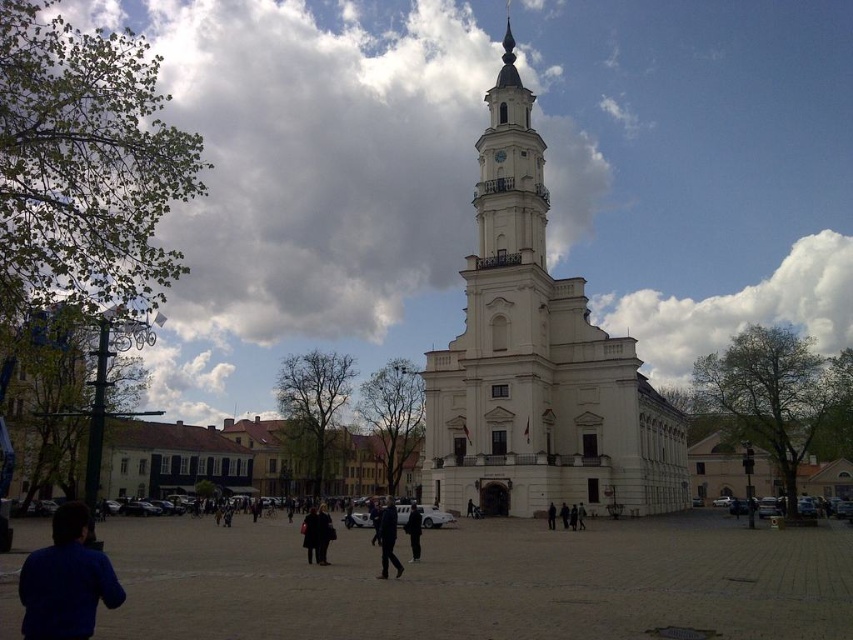
You are a photographer trying to capture both the dark brown leather jacket at center and the dark blue coat at center in the same frame. Since the square is crowded, you need to adjust your camera angle to include both. Which clothing item should you focus on first to ensure both are in the frame?

The dark brown leather jacket at center is shorter than the dark blue coat at center. To include both in the frame, focus on the dark brown leather jacket at center first as it is shorter and adjust the angle to ensure the taller dark blue coat at center is also captured.

Based on the photo, you are a photographer standing in the urban square and want to capture both the dark brown leather jacket at center and the dark blue coat at center in a single frame. Which clothing item will appear smaller in the photo?

The dark brown leather jacket at center will appear smaller in the photo because it has a smaller size compared to the dark blue coat at center.

You are a photographer setting up a tripod in the urban square. You need to position it so that both the blue fabric jacket at lower left and the dark blue jeans at center are visible in the frame. Based on their positions and sizes, which object should you ensure is closer to the center of the frame to avoid cropping?

The blue fabric jacket at lower left might be wider than dark blue jeans at center, so to avoid cropping, you should position the blue fabric jacket at lower left closer to the center of the frame since it is wider and requires more space.